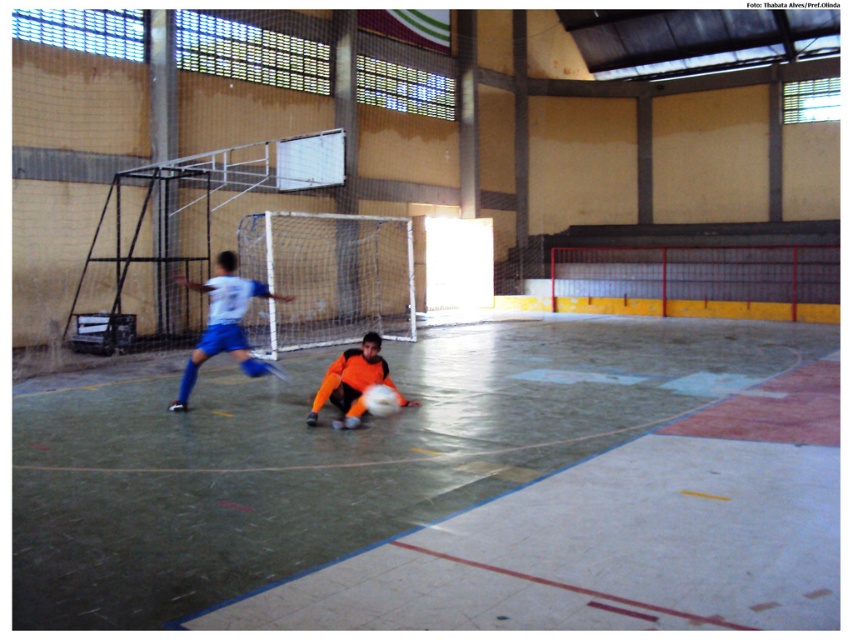
Question: Can you confirm if white mesh net at center is positioned to the left of white matte jersey at center?

Choices:
 (A) no
 (B) yes

Answer: (A)

Question: Which object appears farthest from the camera in this image?

Choices:
 (A) white matte jersey at center
 (B) orange jersey at center

Answer: (A)

Question: Does white mesh net at center have a smaller size compared to white matte jersey at center?

Choices:
 (A) no
 (B) yes

Answer: (A)

Question: Which point is closer to the camera taking this photo?

Choices:
 (A) (366, 348)
 (B) (373, 241)

Answer: (A)

Question: Which object is positioned closest to the orange jersey at center?

Choices:
 (A) white mesh net at center
 (B) white matte jersey at center

Answer: (B)

Question: Does white matte jersey at center have a lesser width compared to orange jersey at center?

Choices:
 (A) no
 (B) yes

Answer: (A)